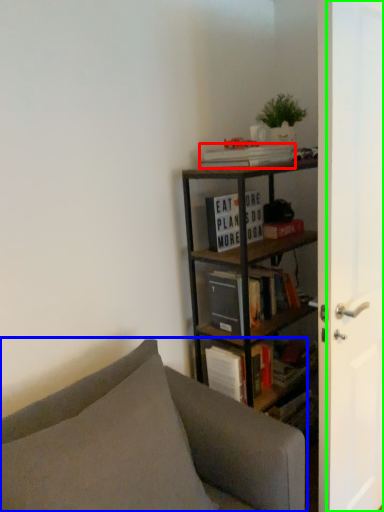
Question: Considering the real-world distances, which object is closest to book (highlighted by a red box)? studio couch (highlighted by a blue box) or screen door (highlighted by a green box).

Choices:
 (A) studio couch
 (B) screen door

Answer: (B)